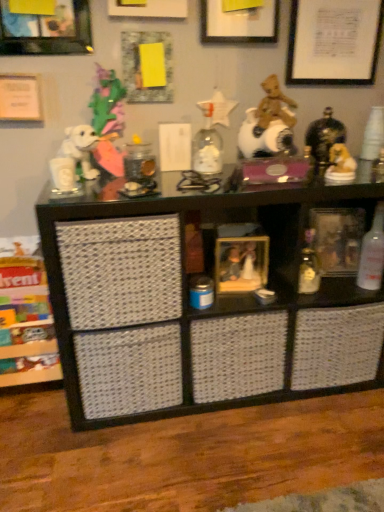
Identify the location of vacant area that is in front of wooden crate at lower left, which is the second shelf from right to left. The height and width of the screenshot is (512, 384). (38, 437).